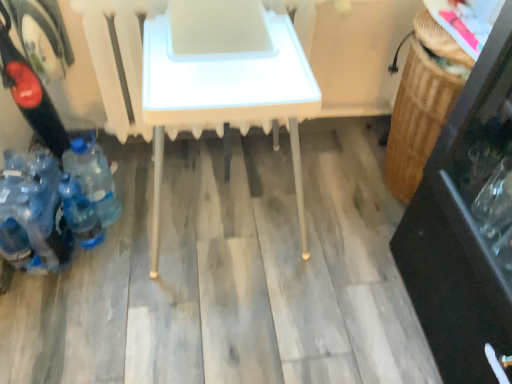
Locate an element on the screen. The image size is (512, 384). vacant space behind blue plastic bottle at lower left, the 3th bottle positioned from the left is located at coordinates (128, 180).